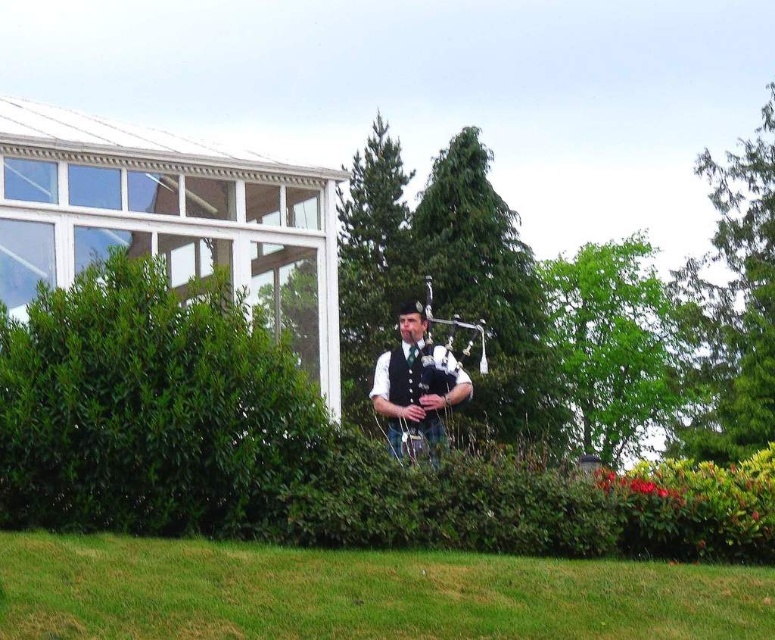
You are standing in the garden and want to place a small decorative statue exactly at the point marked by coordinates point (150, 410). According to the scene description, where will this statue be placed?

The point (150, 410) is on green leafy bush at center, so the statue will be placed on the green leafy bush at center.

You are standing in the garden and want to take a photo of the matte black bagpipes at center without the green leafy bush at center blocking the view. Is the bush in front of or behind the bagpipes?

The green leafy bush at center is closer to the viewer than the matte black bagpipes at center, so the bush is in front of the bagpipes, blocking the view.